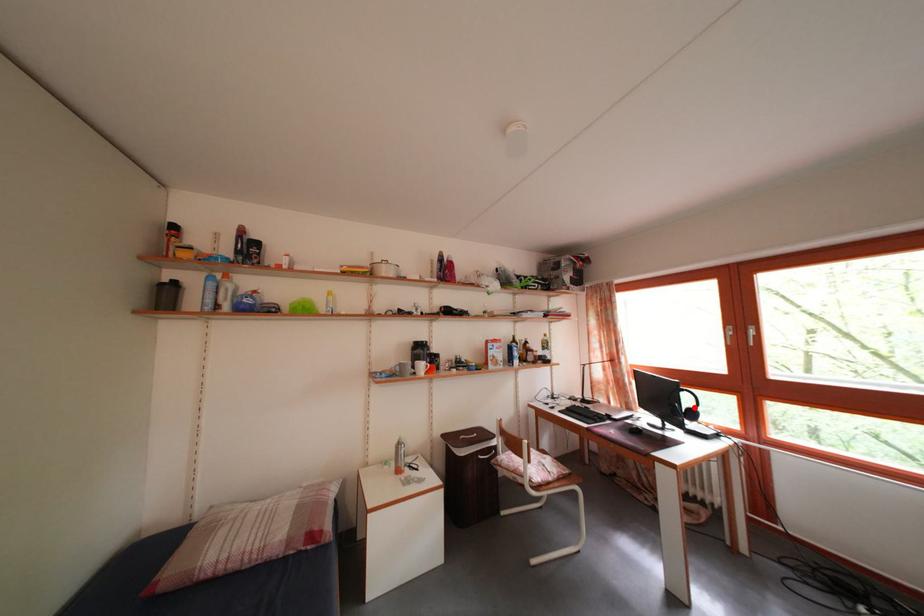
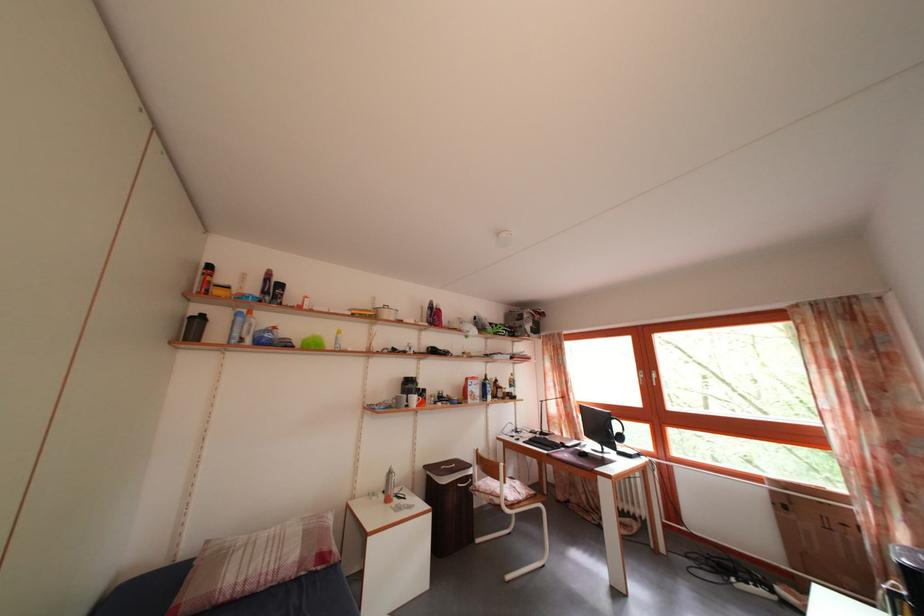
Question: I am providing you with two images of the same scene from different viewpoints. Given a red point in image1, look at the same physical point in image2. Is it:

Choices:
 (A) Closer to the viewpoint
 (B) Farther from the viewpoint

Answer: (B)